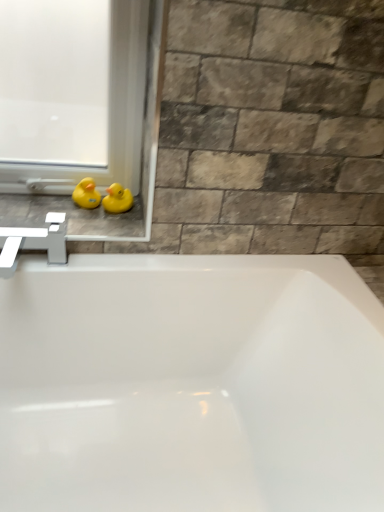
The height and width of the screenshot is (512, 384). Identify the location of free space on the front side of yellow rubber duck at upper left, the first duck positioned from the right. (98, 226).